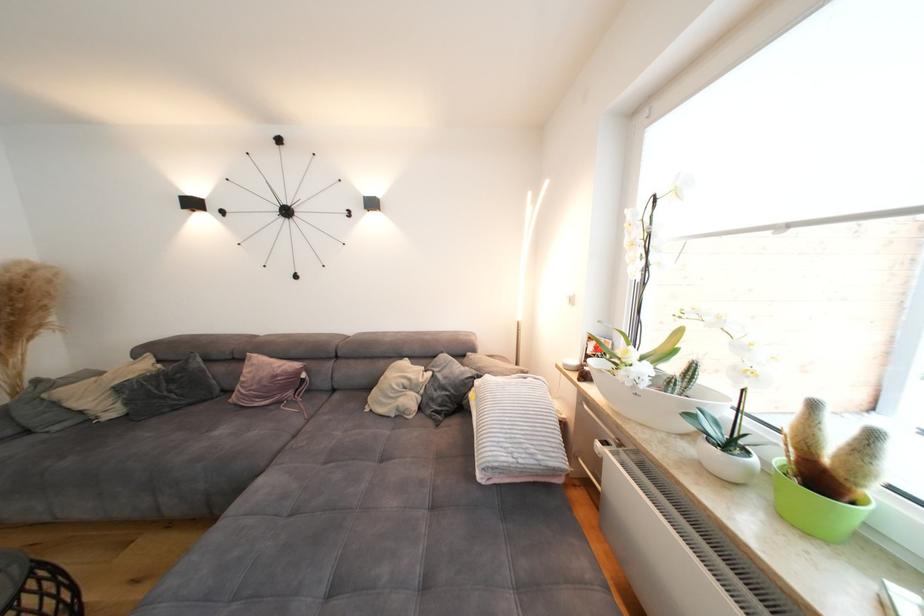
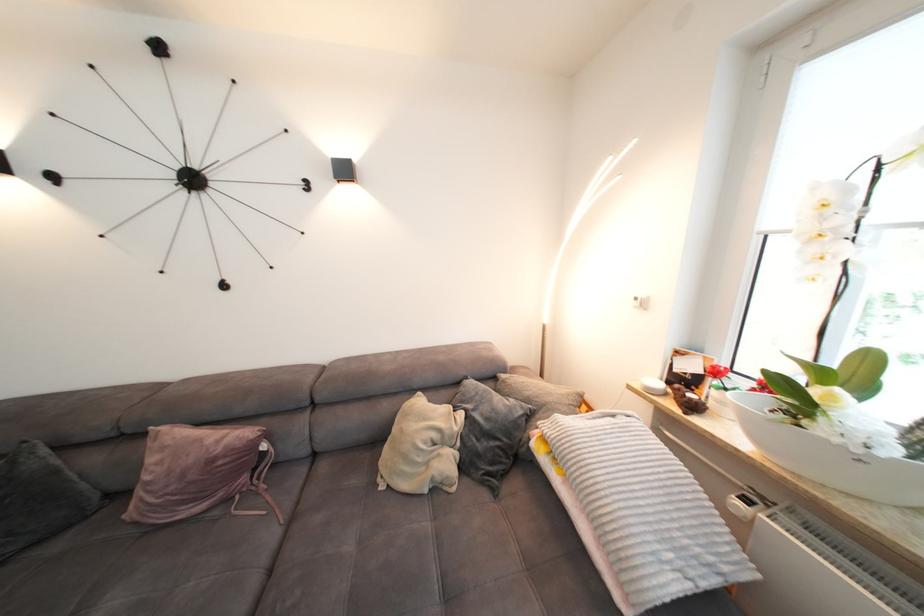
Question: Based on the continuous images, in which direction is the camera rotating? Reply with the corresponding letter.

Choices:
 (A) Left
 (B) Right
 (C) Up
 (D) Down

Answer: (B)